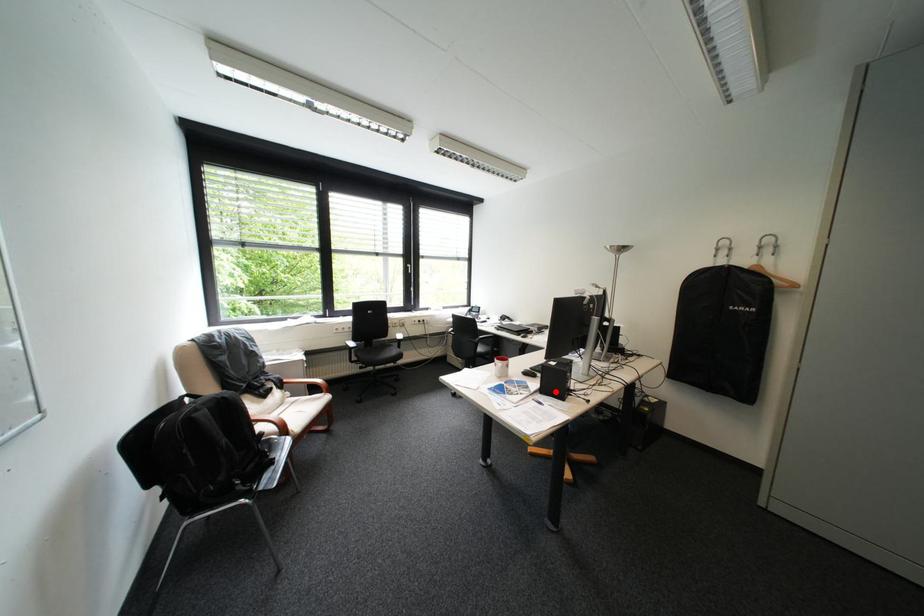
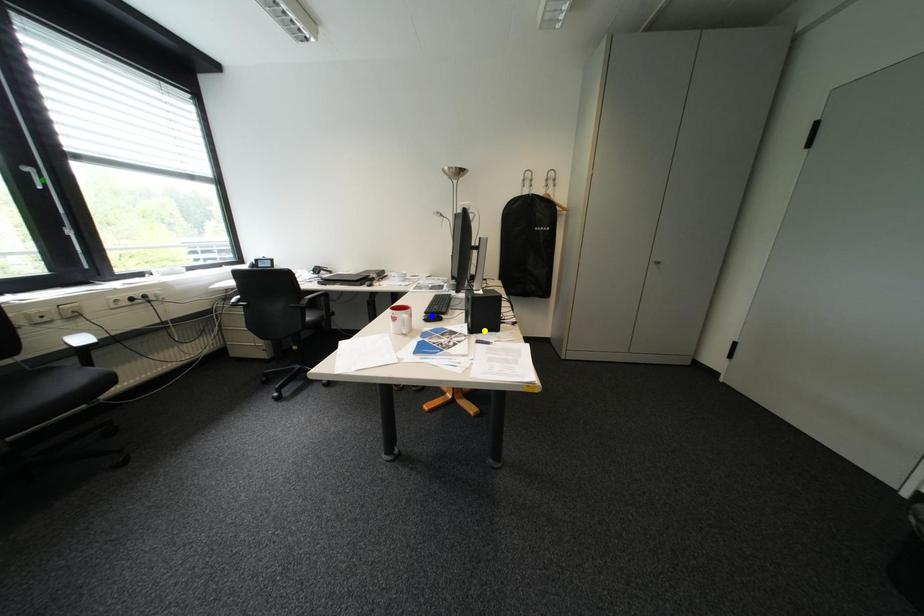
Question: I am providing you with two images of the same scene from different viewpoints. A red point is marked on the first image. You are given multiple points on the second image. Which point in image 2 represents the same 3d spot as the red point in image 1?

Choices:
 (A) yellow point
 (B) green point
 (C) blue point

Answer: (A)